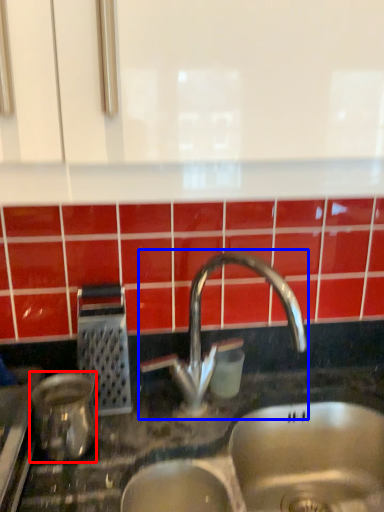
Question: Among these objects, which one is farthest to the camera, appliance (highlighted by a red box) or tap (highlighted by a blue box)?

Choices:
 (A) appliance
 (B) tap

Answer: (B)